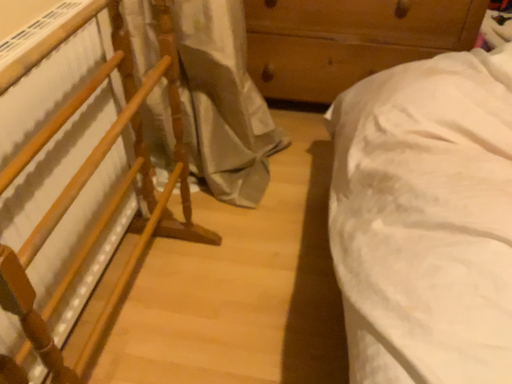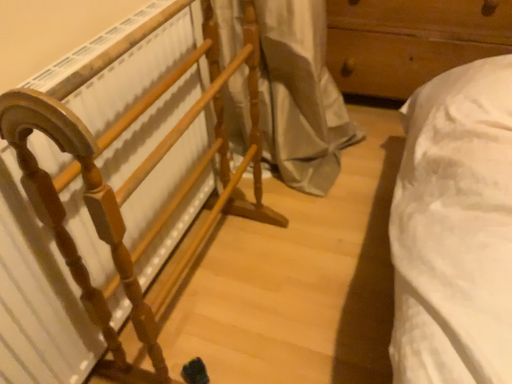
Question: How did the camera likely rotate when shooting the video?

Choices:
 (A) rotated left
 (B) rotated right

Answer: (A)